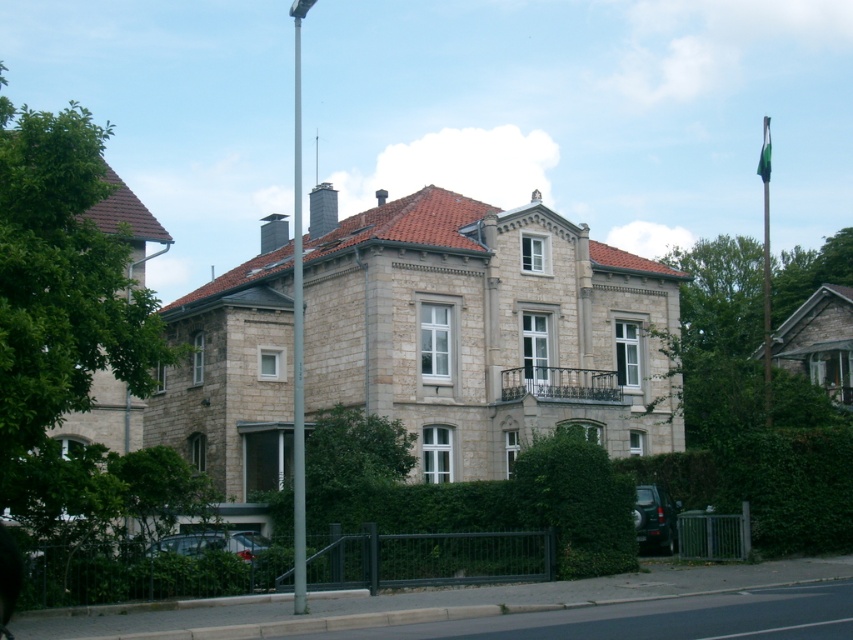
You are a delivery person approaching the house and need to park your shiny metallic car at lower center. The parking spot is directly in front of the green fabric flag pole at right. Will the car block the flagpole from view when parked?

The shiny metallic car at lower center is not as tall as the green fabric flag pole at right, so when parked, the car will not block the flagpole from view since it is shorter in height.

You are standing at the entrance of the two story residential building and want to reach the metallic pole at center. Which direction should you walk to get there?

The metallic pole at center is located at point (x=299, y=337). Since you are at the entrance, you should walk forward towards the center of the scene to reach the metallic pole at center.

You are a delivery person approaching the house and need to park your shiny metallic car at lower center. The parking spot is behind the green fabric flag pole at right. Can you park your car there without moving the flag pole?

The shiny metallic car at lower center is currently in front of the green fabric flag pole at right, so you would need to move the car backward to park behind the flag pole. However, since the flag pole is a fixed structure, you would need to maneuver carefully to ensure the car can fit behind it without obstruction.